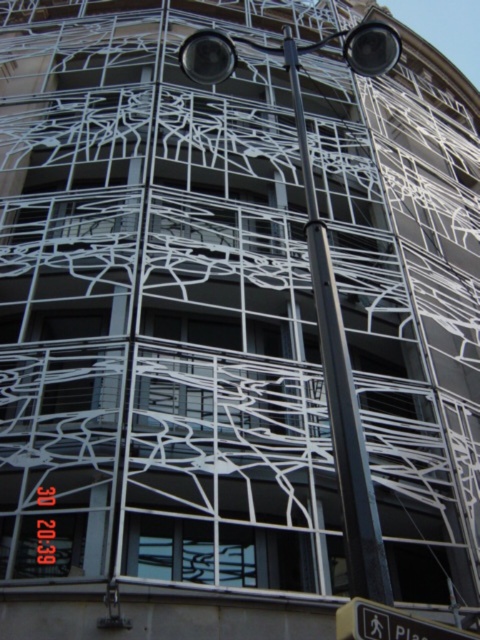
Is black metal pole at center above yellow plastic pedestrian sign at lower right?

Correct, black metal pole at center is located above yellow plastic pedestrian sign at lower right.

Which is behind, point (304, 138) or point (441, 621)?

The point (441, 621) is behind.

You are a GUI agent. You are given a task and a screenshot of the screen. Output one action in this format:
    pyautogui.click(x=<x>, y=<y>)
    Task: Click on the black metal pole at center
    The image size is (480, 640).
    Given the screenshot: What is the action you would take?
    pyautogui.click(x=339, y=387)